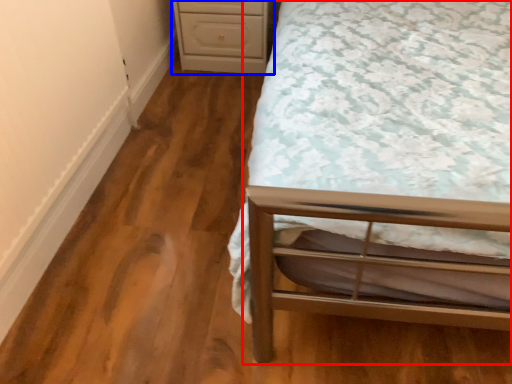
Question: Which point is further to the camera, bed (highlighted by a red box) or chest of drawers (highlighted by a blue box)?

Choices:
 (A) bed
 (B) chest of drawers

Answer: (B)